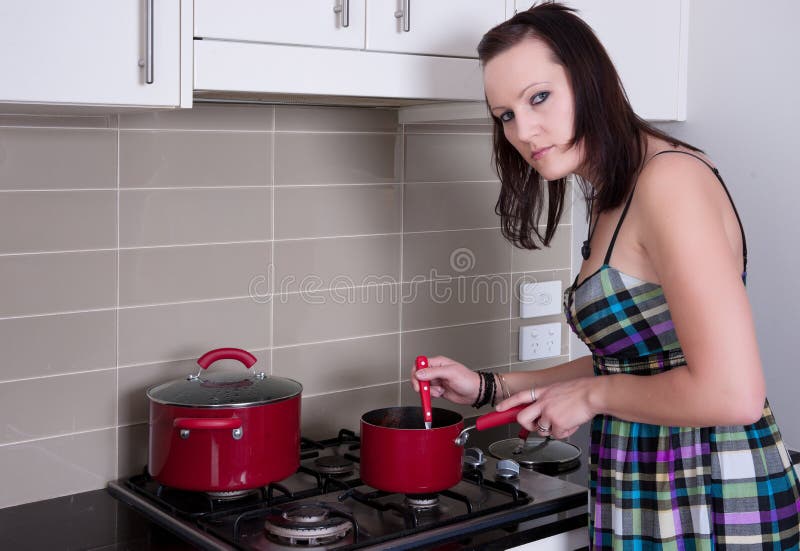
The width and height of the screenshot is (800, 551). Find the location of `pot`. pot is located at coordinates (409, 449).